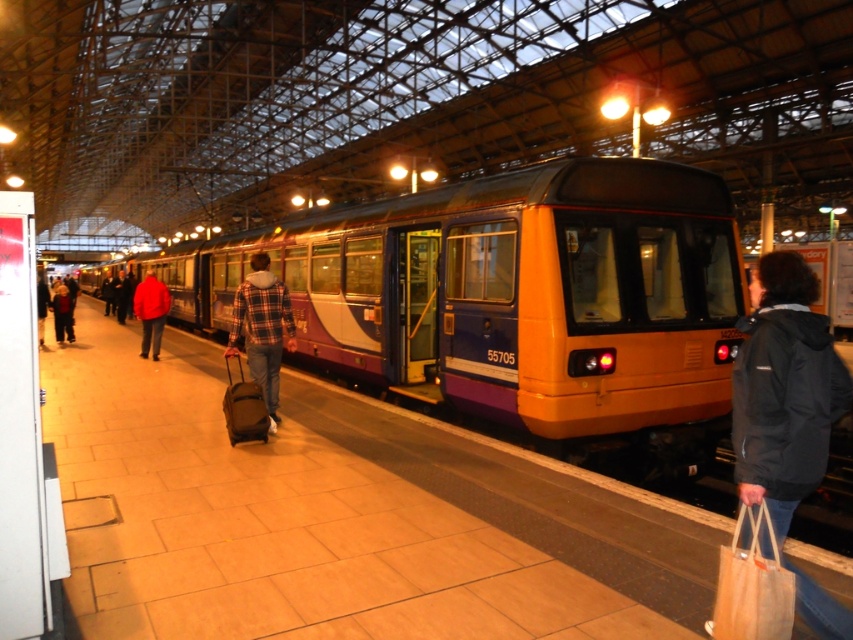
You are a photographer standing on the platform and want to take a photo of both the plaid fabric jacket at center and the red jacket at left. Which jacket should you focus on first if you want to capture both in the frame without moving the camera?

The plaid fabric jacket at center has a lesser width compared to red jacket at left, so you should focus on the red jacket at left first as it is wider and might require more space in the frame to ensure both are captured properly.

You are standing on the train station platform and want to take a photo that includes both points marked as point (540,429) and point (146,339). To ensure both are in focus, which point should you focus on first?

You should focus on point (540,429) first because it is closer to the camera than point (146,339). This ensures the closer point is in focus, and the farther point may also be within the depth of field.

You are standing on the platform and want to board the metallic purple train at center. There is a height restriction sign stating that the entrance is only 1.5 meters tall. Considering the dark blue jeans at lower left belong to a person of average height, can you safely enter the train?

The metallic purple train at center is much taller than the dark blue jeans at lower left, which belong to a person of average height. Since the entrance height is 1.5 meters, which is typical for average human height, the train entrance should accommodate the average person comfortably. Therefore, you can safely enter the train.